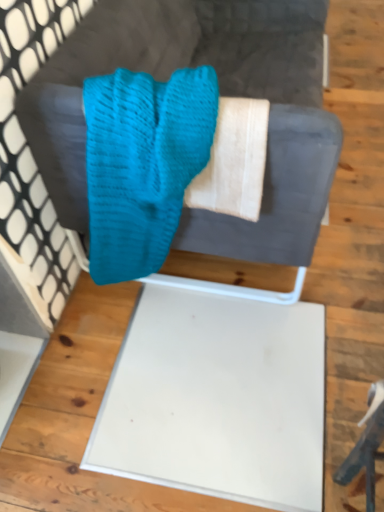
Where is `free spot above teal knitted scrub at center (from a real-world perspective)`? The width and height of the screenshot is (384, 512). free spot above teal knitted scrub at center (from a real-world perspective) is located at coordinates (173, 98).